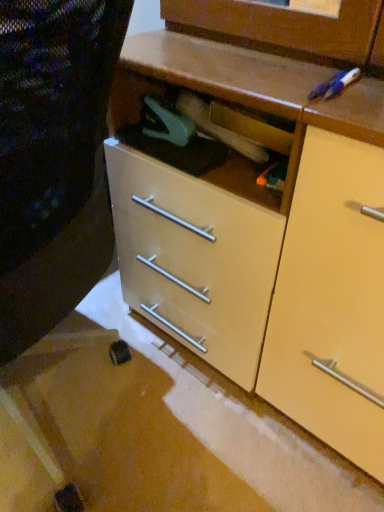
Image resolution: width=384 pixels, height=512 pixels. In order to click on matte black swivel chair at lower left in this screenshot , I will do `click(53, 159)`.

In order to face matte black swivel chair at lower left, should I rotate leftwards or rightwards?

Rotate left and turn 22.574 degrees.

Measure the distance between matte black swivel chair at lower left and camera.

14.41 inches.

The height and width of the screenshot is (512, 384). What do you see at coordinates (53, 159) in the screenshot?
I see `matte black swivel chair at lower left` at bounding box center [53, 159].

Identify the location of matte black swivel chair at lower left. The image size is (384, 512). (53, 159).